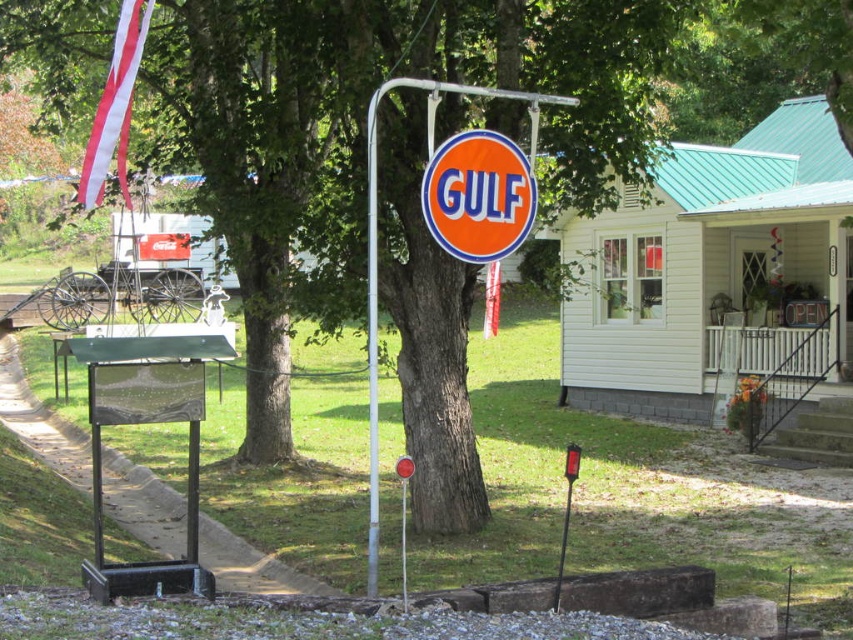
Does green glossy sign at lower left appear over orange glossy sign at center?

No.

Is green glossy sign at lower left shorter than orange glossy sign at center?

Yes.

Where is `green glossy sign at lower left`? green glossy sign at lower left is located at coordinates (143, 422).

In the scene shown: Does green glossy sign at lower left appear under metallic pole at center?

Yes, green glossy sign at lower left is below metallic pole at center.

Where is `green glossy sign at lower left`? green glossy sign at lower left is located at coordinates (143, 422).

Identify the location of green glossy sign at lower left. (143, 422).

Can you confirm if red plastic sign at lower center is positioned to the right of metallic red stop sign at center?

Indeed, red plastic sign at lower center is positioned on the right side of metallic red stop sign at center.

Who is more forward, (556, 586) or (405, 493)?

Positioned in front is point (556, 586).

Identify the location of red plastic sign at lower center. The width and height of the screenshot is (853, 640). (566, 513).